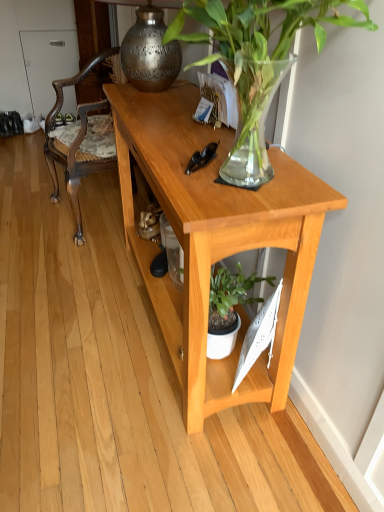
What are the coordinates of `free spot below green glossy plant at upper center (from a real-world perspective)` in the screenshot? It's located at (227, 182).